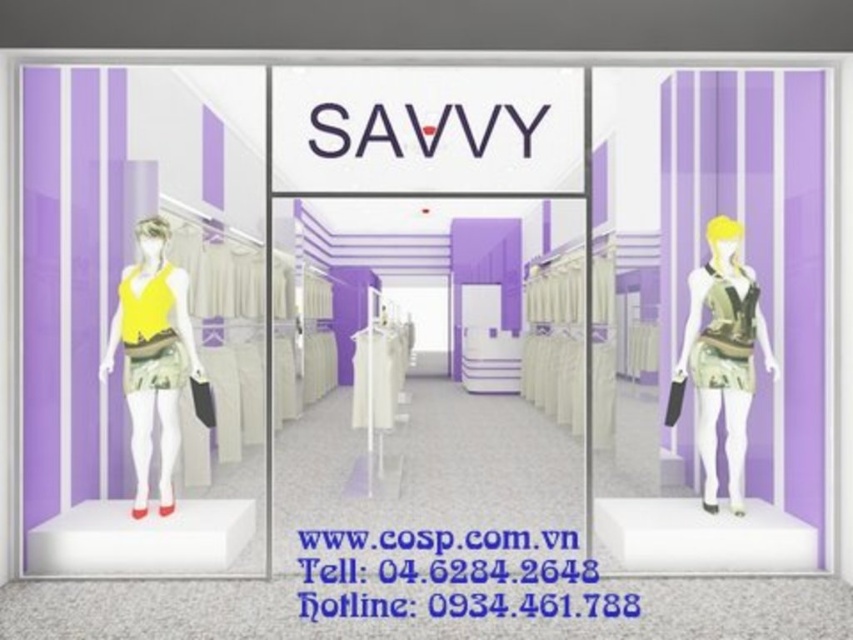
Question: Among these objects, which one is nearest to the camera?

Choices:
 (A) yellow matte dress at left
 (B) matte yellow dress at left
 (C) matte yellow fabric dress at left
 (D) matte purple mannequin at right

Answer: (B)

Question: Based on their relative distances, which object is farther from the matte yellow fabric dress at left?

Choices:
 (A) printed fabric dress at right
 (B) matte yellow dress at left

Answer: (A)

Question: In this image, where is matte purple mannequin at right located relative to printed fabric dress at right?

Choices:
 (A) right
 (B) left

Answer: (A)

Question: Considering the relative positions of matte yellow dress at left and camouflage-patterned fabric dress at right in the image provided, where is matte yellow dress at left located with respect to camouflage-patterned fabric dress at right?

Choices:
 (A) right
 (B) left

Answer: (B)

Question: Among these objects, which one is farthest from the camera?

Choices:
 (A) camouflage-patterned fabric dress at right
 (B) printed fabric dress at right
 (C) matte yellow dress at left

Answer: (A)

Question: Does matte purple mannequin at right come in front of matte yellow fabric dress at left?

Choices:
 (A) no
 (B) yes

Answer: (B)